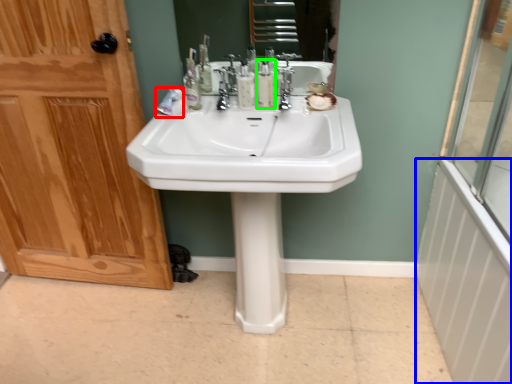
Question: Which object is positioned farthest from toothpaste (highlighted by a red box)? Select from radiator (highlighted by a blue box) and mouthwash (highlighted by a green box).

Choices:
 (A) radiator
 (B) mouthwash

Answer: (A)